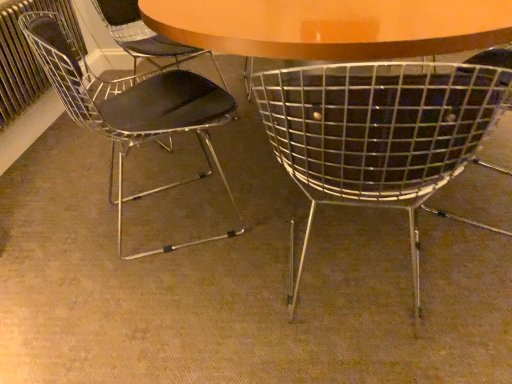
Question: From a real-world perspective, relative to metallic radiator at left, is metallic wire chair at left, which appears as the 2th chair when viewed from the right, vertically above or below?

Choices:
 (A) above
 (B) below

Answer: (B)

Question: Considering the positions of metallic wire chair at left, the 1th chair from the left, and metallic radiator at left in the image, is metallic wire chair at left, the 1th chair from the left, bigger or smaller than metallic radiator at left?

Choices:
 (A) big
 (B) small

Answer: (A)

Question: Which object is the farthest from the metal mesh chair at center, which is the second chair in left-to-right order?

Choices:
 (A) metallic wire chair at left, the 1th chair from the left
 (B) metallic radiator at left

Answer: (B)

Question: Which object is positioned closest to the metallic radiator at left?

Choices:
 (A) metal mesh chair at center, which is the second chair in left-to-right order
 (B) metallic wire chair at left, the 1th chair from the left

Answer: (B)